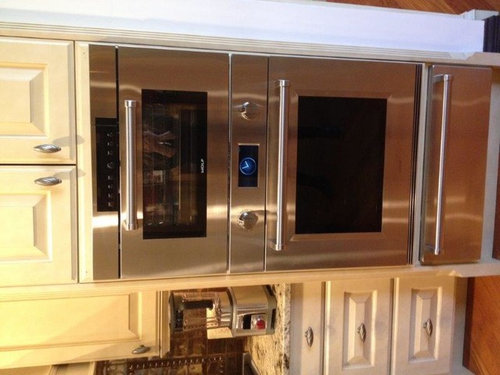
Find the location of `knobs`. knobs is located at coordinates (112, 205), (112, 196), (110, 189), (111, 178), (112, 167), (111, 154), (110, 145), (109, 136).